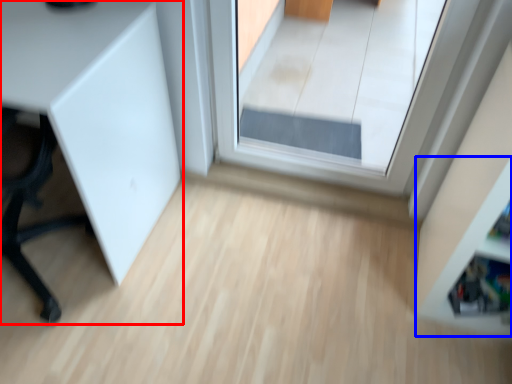
Question: Which object appears farthest to the camera in this image, furniture (highlighted by a red box) or shelf (highlighted by a blue box)?

Choices:
 (A) furniture
 (B) shelf

Answer: (A)